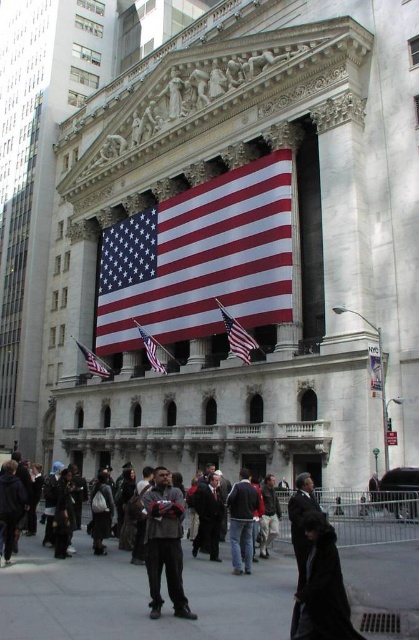
You are standing in front of the grand neoclassical building with the large American flag displayed. There are two points marked on the building facade at coordinates point [307,540] and point [150,339]. If you were to walk towards the building, which point would you encounter first?

Point [307,540] is in front of point [150,339], so you would encounter point [307,540] first as you walk towards the building.